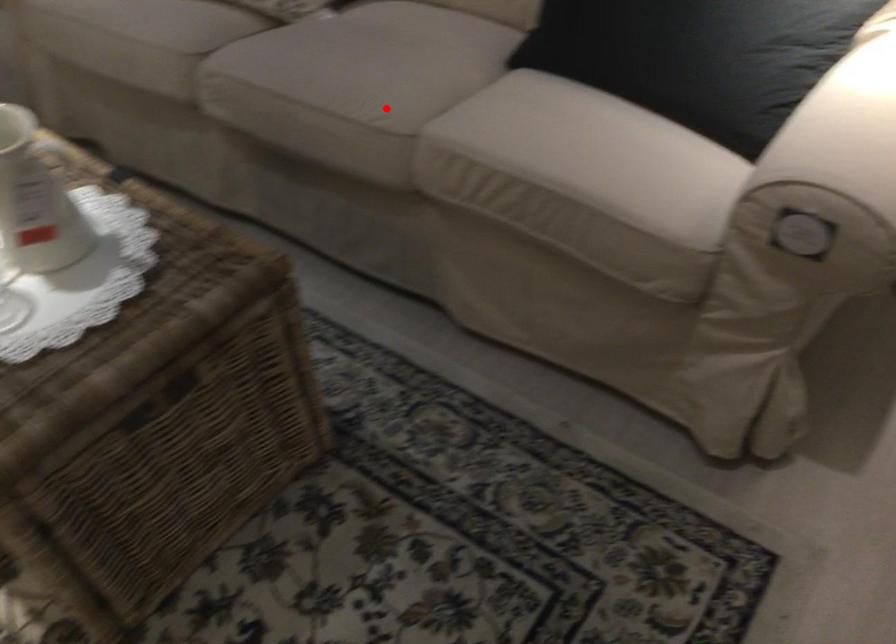
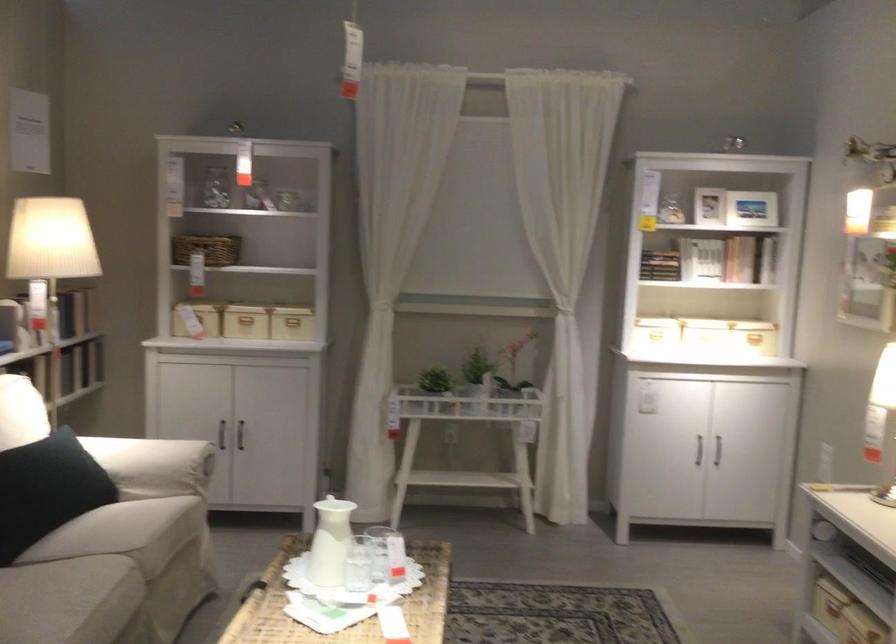
Find the pixel in the second image that matches the highlighted location in the first image.

(110, 576)